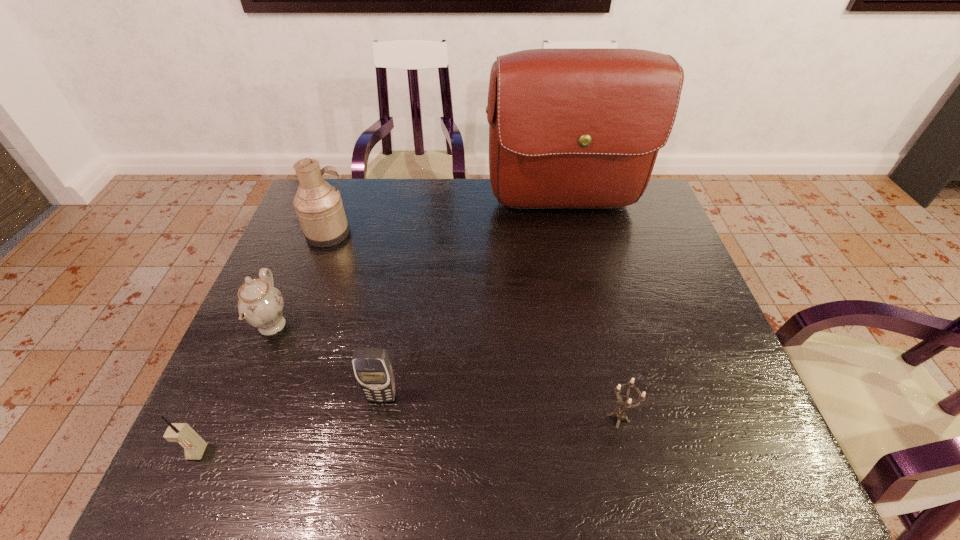
Identify the location of free spot between the fourth nearest object and the candle holder. (445, 372).

Find the location of a particular element. This screenshot has height=540, width=960. free area in between the pitcher and the satchel is located at coordinates (446, 220).

Identify the location of free area in between the third farthest object and the pitcher. (300, 279).

Locate an element on the screen. The width and height of the screenshot is (960, 540). vacant point located between the satchel and the nearer cellular telephone is located at coordinates (381, 330).

This screenshot has width=960, height=540. I want to click on blank region between the chinaware and the nearer cellular telephone, so click(234, 389).

Where is `vacant space that is in between the right cellular telephone and the satchel`? This screenshot has width=960, height=540. vacant space that is in between the right cellular telephone and the satchel is located at coordinates (473, 302).

Find the location of a particular element. This screenshot has height=540, width=960. free space that is in between the pitcher and the chinaware is located at coordinates (300, 279).

In order to click on vacant point located between the left cellular telephone and the chinaware in this screenshot , I will do `click(234, 389)`.

You are a GUI agent. You are given a task and a screenshot of the screen. Output one action in this format:
    pyautogui.click(x=<x>, y=<y>)
    Task: Click on the vacant space in between the chinaware and the farther cellular telephone
    This screenshot has width=960, height=540.
    Given the screenshot: What is the action you would take?
    click(326, 361)

What are the coordinates of `object that is the third nearest to the fourth nearest object` in the screenshot? It's located at (373, 370).